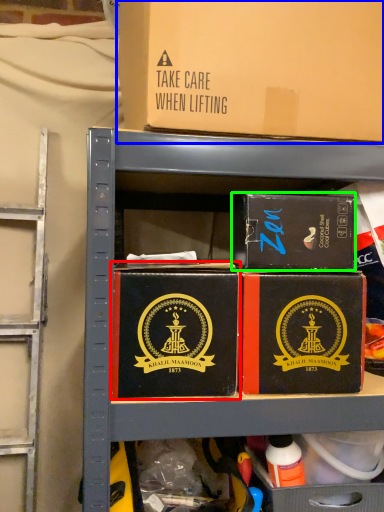
Question: Which is nearer to the box (highlighted by a red box)? box (highlighted by a blue box) or box (highlighted by a green box).

Choices:
 (A) box
 (B) box

Answer: (B)